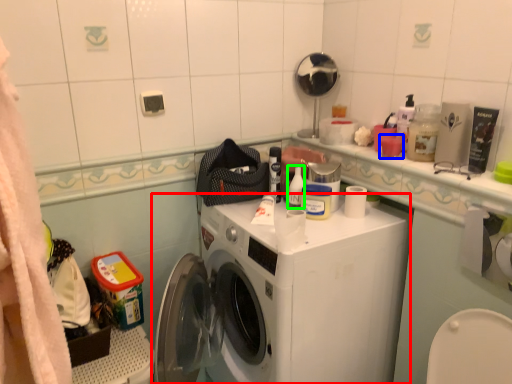
Question: Considering the real-world distances, which object is closest to washing machine (highlighted by a red box)? toiletry (highlighted by a blue box) or toiletry (highlighted by a green box).

Choices:
 (A) toiletry
 (B) toiletry

Answer: (B)